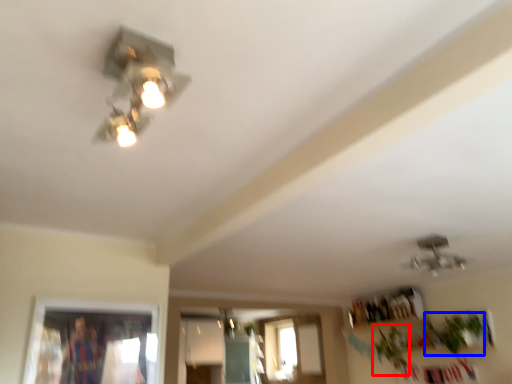
Question: Which object appears farthest to the camera in this image, plant (highlighted by a red box) or plant (highlighted by a blue box)?

Choices:
 (A) plant
 (B) plant

Answer: (A)